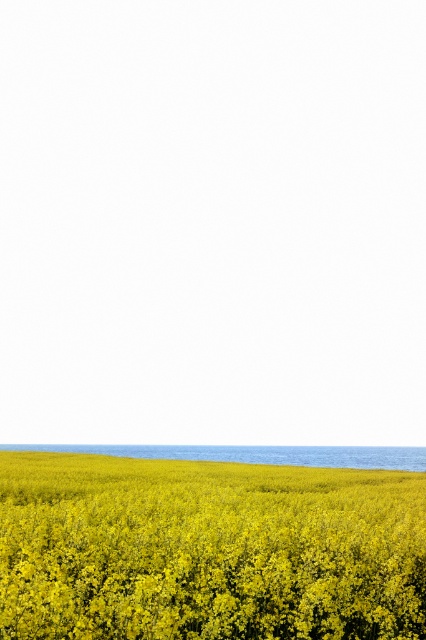
You are a photographer trying to capture the entire scene of the yellow matte flower at bottom and the blue smooth water at bottom in one shot. Based on their sizes, which object should you focus on to ensure both are visible in the frame?

Since the yellow matte flower at bottom is smaller than the blue smooth water at bottom, you should focus on the yellow matte flower at bottom to ensure both are visible in the frame.

You are standing in the field of yellow matte flower at bottom and looking towards the blue smooth water at bottom. Which object is taller from your perspective?

The blue smooth water at bottom is taller than the yellow matte flower at bottom.

You are standing at the center of the field and want to pick the yellow matte flower at bottom. In which direction should you walk to reach it?

The yellow matte flower at bottom is located at point (x=207, y=550), which is to the lower right of your current position. You should walk towards the lower right direction to reach it.